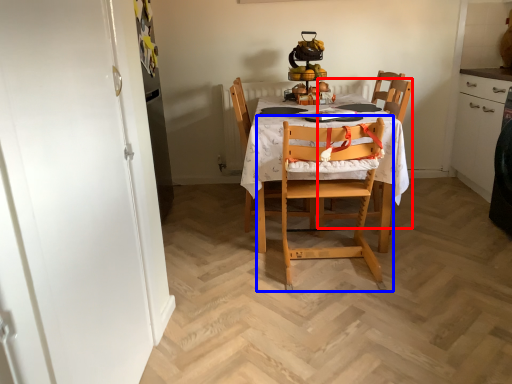
Question: Among these objects, which one is farthest to the camera, chair (highlighted by a red box) or chair (highlighted by a blue box)?

Choices:
 (A) chair
 (B) chair

Answer: (A)